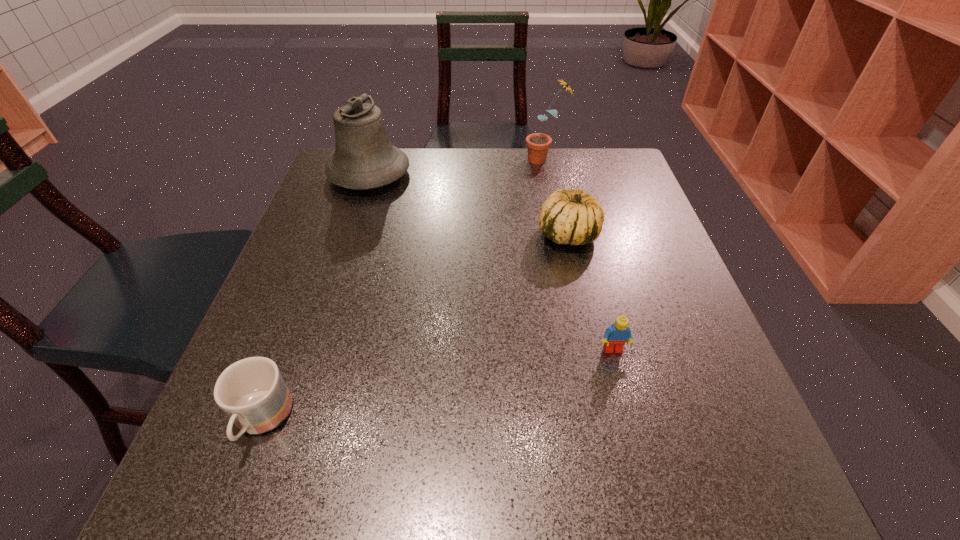
At what (x,y) coordinates should I click in order to perform the action: click on sunflower. Please return your answer as a coordinate pair (x, y). Image resolution: width=960 pixels, height=540 pixels. Looking at the image, I should click on (538, 144).

Identify the location of bell. This screenshot has width=960, height=540. (364, 158).

Identify the location of the third shortest object. This screenshot has height=540, width=960. (568, 216).

Find the location of `the third farthest object`. the third farthest object is located at coordinates (568, 216).

Image resolution: width=960 pixels, height=540 pixels. In order to click on Lego in this screenshot , I will do `click(615, 336)`.

Image resolution: width=960 pixels, height=540 pixels. What are the coordinates of `the nearest object` in the screenshot? It's located at (252, 392).

Image resolution: width=960 pixels, height=540 pixels. I want to click on blank area located 0.220m on the flower of the sunflower, so click(x=446, y=159).

Identify the location of free spot located 0.170m on the flower of the sunflower. This screenshot has height=540, width=960. (465, 159).

Find the location of `vacant space located on the flower of the sunflower`. vacant space located on the flower of the sunflower is located at coordinates (425, 159).

At what (x,y) coordinates should I click in order to perform the action: click on free space located 0.190m on the front of the bell. Please return your answer as a coordinate pair (x, y). Image resolution: width=960 pixels, height=540 pixels. Looking at the image, I should click on (346, 247).